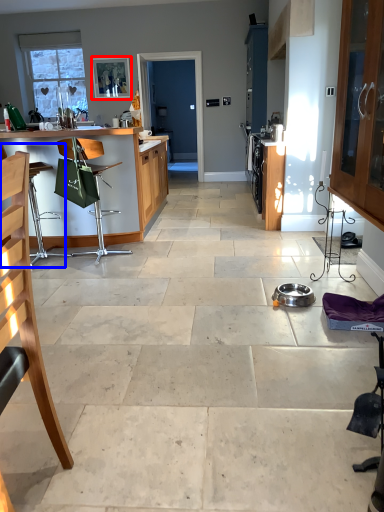
Question: Which point is closer to the camera, picture frame (highlighted by a red box) or armchair (highlighted by a blue box)?

Choices:
 (A) picture frame
 (B) armchair

Answer: (B)